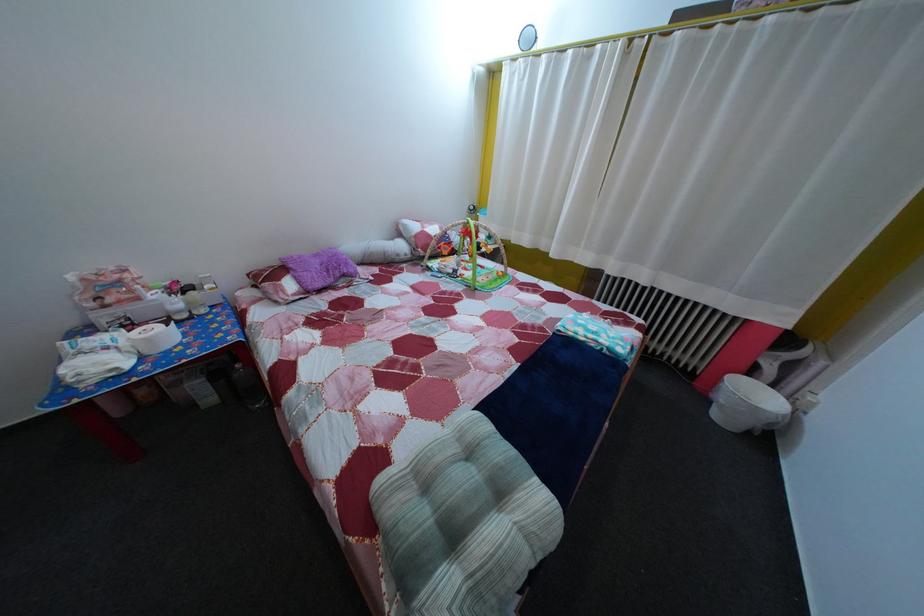
Where would you lift the purple fuzzy pillow? Please return your answer as a coordinate pair (x, y).

(320, 268)